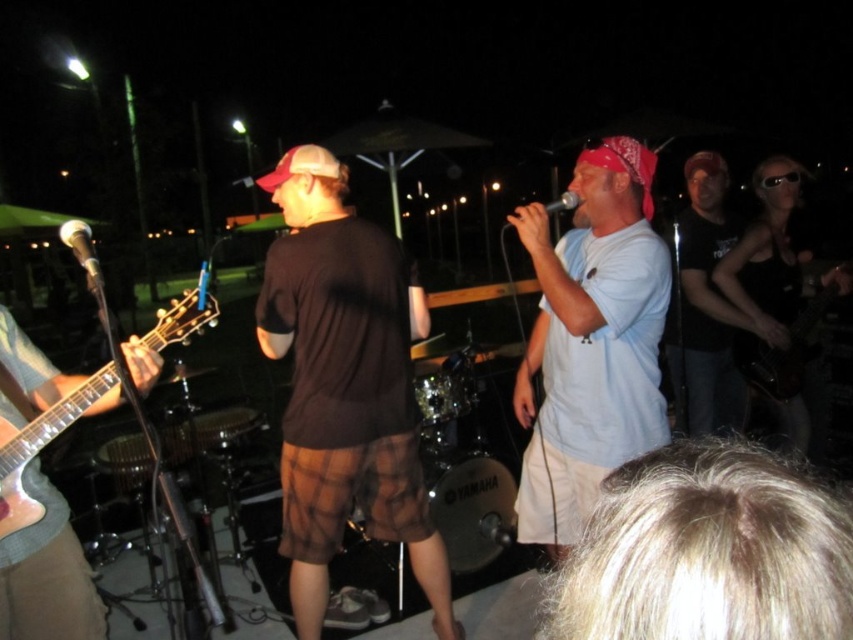
You are a stagehand setting up equipment for a band. You have a metallic silver guitar at left and a matte black microphone at center. Which object is narrower?

Result: The metallic silver guitar at left is thinner than the matte black microphone at center, so the metallic silver guitar at left is narrower.